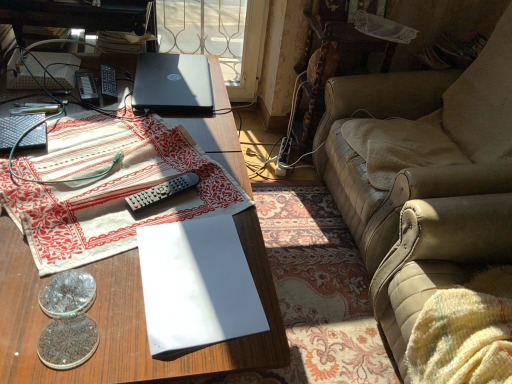
The height and width of the screenshot is (384, 512). Identify the location of vacant space that is in between white paper at left, the first paperback book from the left, and gray plastic remote at center, placed as the first remote control when sorted from bottom to top. (93, 132).